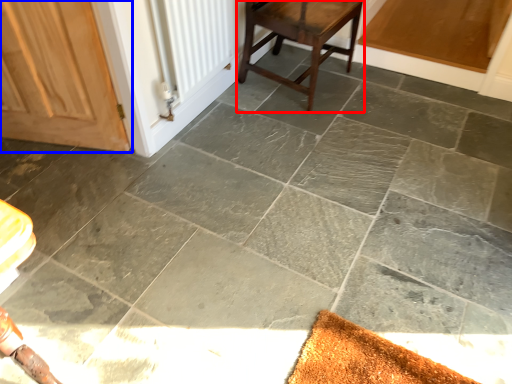
Question: Among these objects, which one is farthest to the camera, stool (highlighted by a red box) or door (highlighted by a blue box)?

Choices:
 (A) stool
 (B) door

Answer: (A)